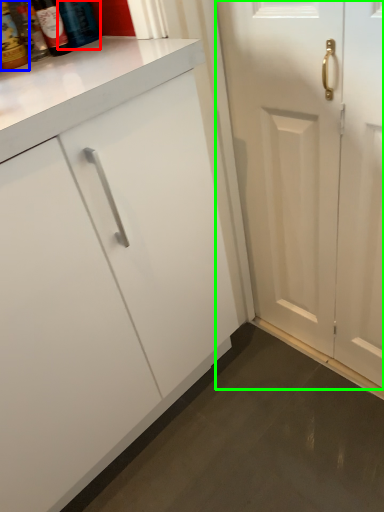
Question: Based on their relative distances, which object is nearer to bottle (highlighted by a red box)? Choose from bottle (highlighted by a blue box) and door (highlighted by a green box).

Choices:
 (A) bottle
 (B) door

Answer: (A)